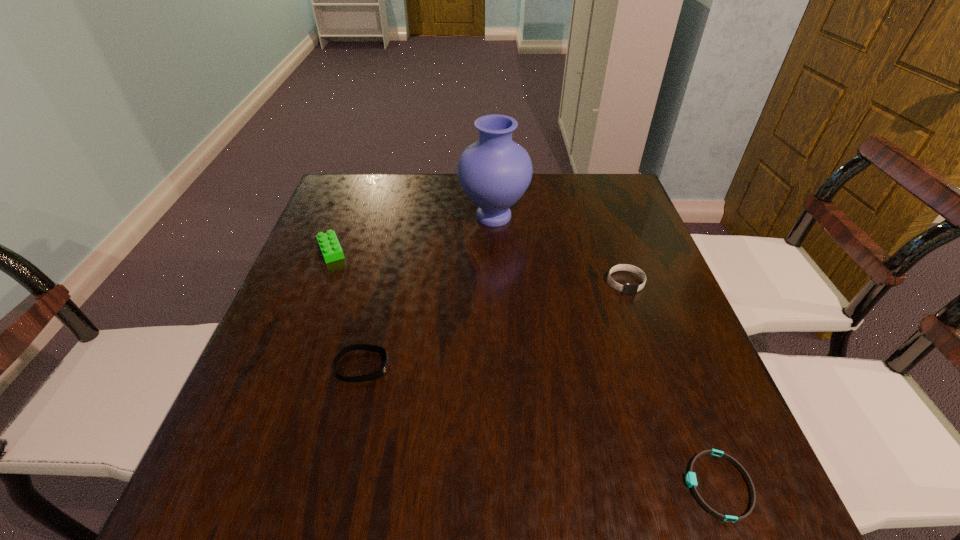
Locate an element on the screen. This screenshot has width=960, height=540. free region that satisfies the following two spatial constraints: 1. on the back side of the leftmost object; 2. on the left side of the tallest object is located at coordinates (344, 217).